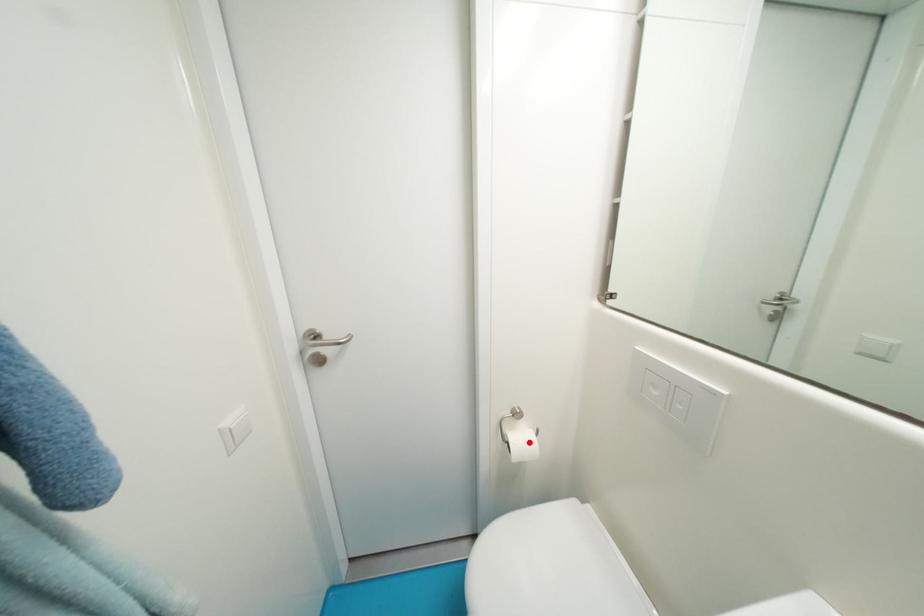
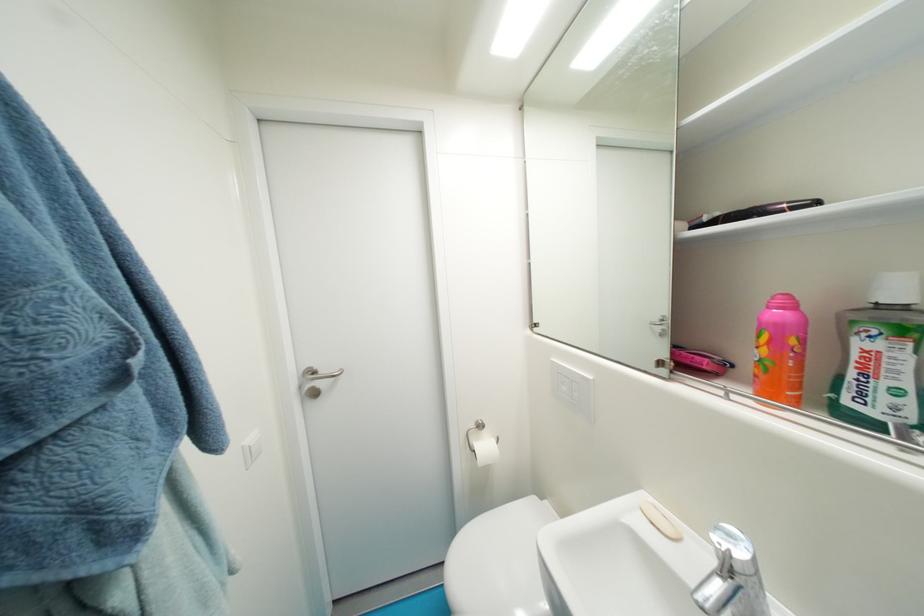
The point at the highlighted location is marked in the first image. Where is the corresponding point in the second image?

(492, 448)